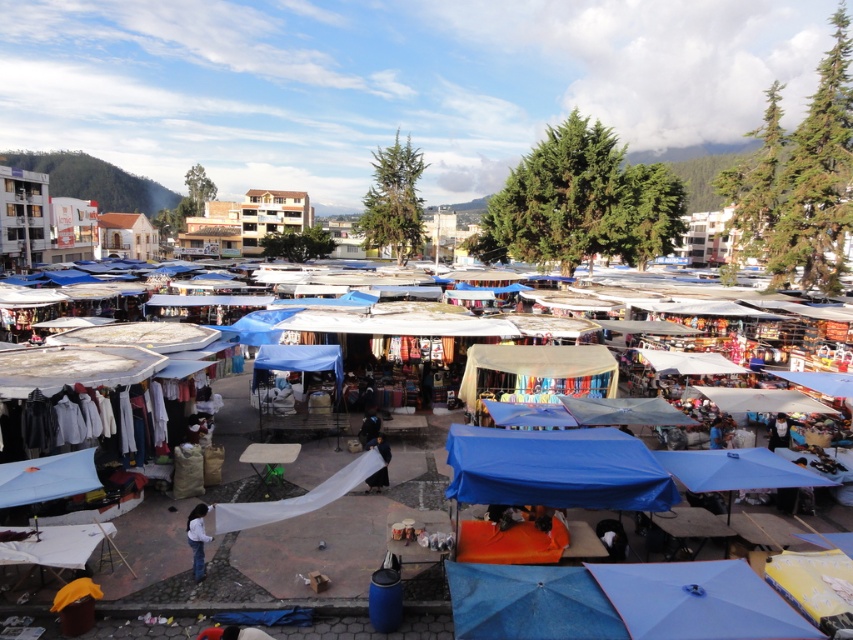
Question: Which of the following is the closest to the observer?

Choices:
 (A) (366, 412)
 (B) (193, 508)
 (C) (776, 442)

Answer: (B)

Question: Where is white fabric at lower left located in relation to smooth skin face at center in the image?

Choices:
 (A) above
 (B) below

Answer: (B)

Question: Estimate the real-world distances between objects in this image. Which object is farther from the white fabric at center?

Choices:
 (A) smooth skin face at center
 (B) blue fabric canopy at center

Answer: (A)

Question: Can you confirm if dark blue fabric at center is wider than white fabric at lower left?

Choices:
 (A) no
 (B) yes

Answer: (A)

Question: Is white fabric at center to the left of dark blue fabric at center from the viewer's perspective?

Choices:
 (A) yes
 (B) no

Answer: (A)

Question: Among these objects, which one is nearest to the camera?

Choices:
 (A) blue fabric canopy at center
 (B) smooth skin face at center
 (C) white fabric at lower left

Answer: (A)